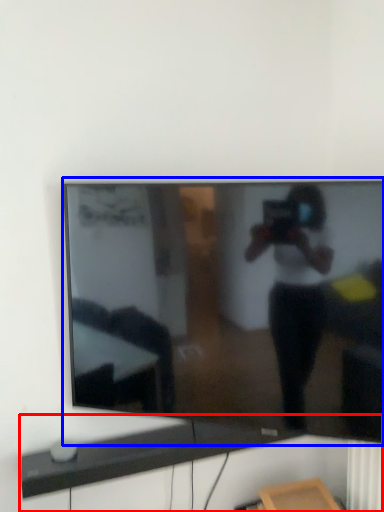
Question: Which point is further to the camera, computer desk (highlighted by a red box) or television (highlighted by a blue box)?

Choices:
 (A) computer desk
 (B) television

Answer: (A)